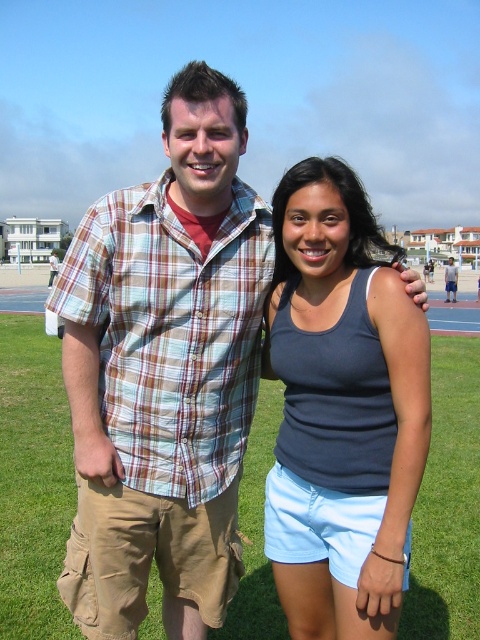
Where is `plaid cotton shirt at center`? plaid cotton shirt at center is located at coordinates (165, 371).

Who is shorter, plaid cotton shirt at center or plaid shirt at center?

With less height is plaid cotton shirt at center.

This screenshot has width=480, height=640. In order to click on plaid cotton shirt at center in this screenshot , I will do `click(165, 371)`.

Locate an element on the screen. The width and height of the screenshot is (480, 640). plaid cotton shirt at center is located at coordinates (x=165, y=371).

Can you confirm if plaid cotton shirt at center is positioned to the left of matte blue tank top at center?

Indeed, plaid cotton shirt at center is positioned on the left side of matte blue tank top at center.

Is plaid cotton shirt at center positioned behind matte blue tank top at center?

Yes, it is behind matte blue tank top at center.

Image resolution: width=480 pixels, height=640 pixels. I want to click on plaid cotton shirt at center, so click(165, 371).

Is green grass at center smaller than plaid shirt at center?

Correct, green grass at center occupies less space than plaid shirt at center.

Does green grass at center appear on the left side of plaid shirt at center?

Correct, you'll find green grass at center to the left of plaid shirt at center.

Does point (434, 442) come in front of point (448, 268)?

Yes, it is in front of point (448, 268).

Where is `green grass at center`? The width and height of the screenshot is (480, 640). green grass at center is located at coordinates (33, 481).